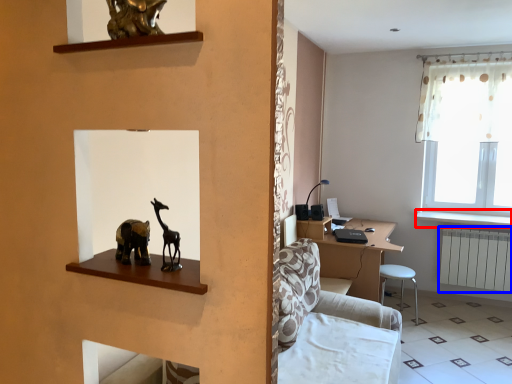
Question: Which object appears farthest to the camera in this image, window sill (highlighted by a red box) or radiator (highlighted by a blue box)?

Choices:
 (A) window sill
 (B) radiator

Answer: (B)